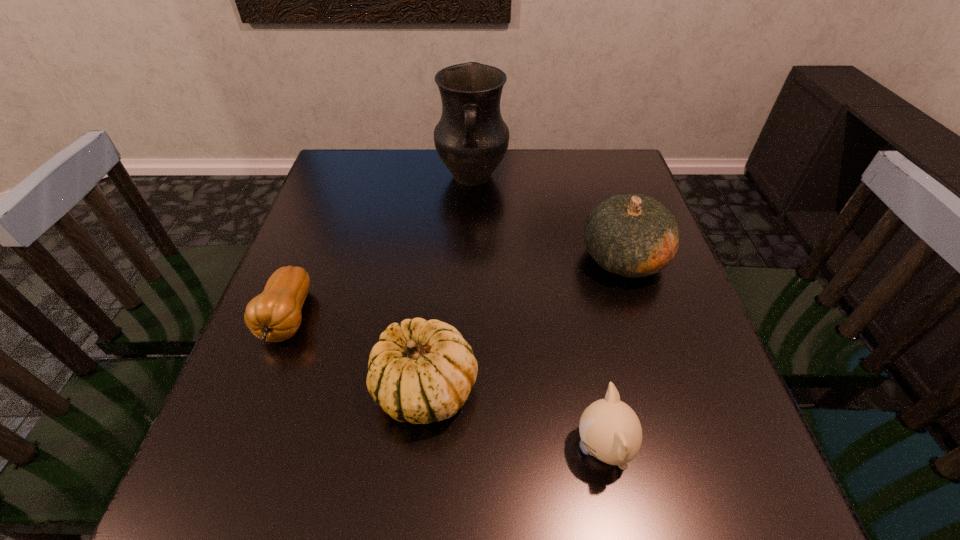
Find the location of a particular element. This screenshot has width=960, height=540. the tallest object is located at coordinates (471, 138).

Locate an element on the screen. the farthest object is located at coordinates (471, 138).

This screenshot has height=540, width=960. I want to click on the rightmost gourd, so click(633, 235).

You are a GUI agent. You are given a task and a screenshot of the screen. Output one action in this format:
    pyautogui.click(x=<x>, y=<y>)
    Task: Click on the second gourd from left to right
    The height and width of the screenshot is (540, 960).
    Given the screenshot: What is the action you would take?
    pyautogui.click(x=420, y=371)

This screenshot has height=540, width=960. I want to click on kitten, so click(610, 430).

This screenshot has width=960, height=540. Find the location of `the leftmost gourd`. the leftmost gourd is located at coordinates (274, 315).

Where is `the leftmost object`? The width and height of the screenshot is (960, 540). the leftmost object is located at coordinates (274, 315).

This screenshot has height=540, width=960. Find the location of `free region located 0.360m on the handle side of the farthest object`. free region located 0.360m on the handle side of the farthest object is located at coordinates (469, 302).

Identify the location of free space located 0.200m on the back of the rightmost gourd. The image size is (960, 540). (x=599, y=184).

Where is `free space located on the right of the second gourd from left to right`? This screenshot has height=540, width=960. free space located on the right of the second gourd from left to right is located at coordinates (612, 389).